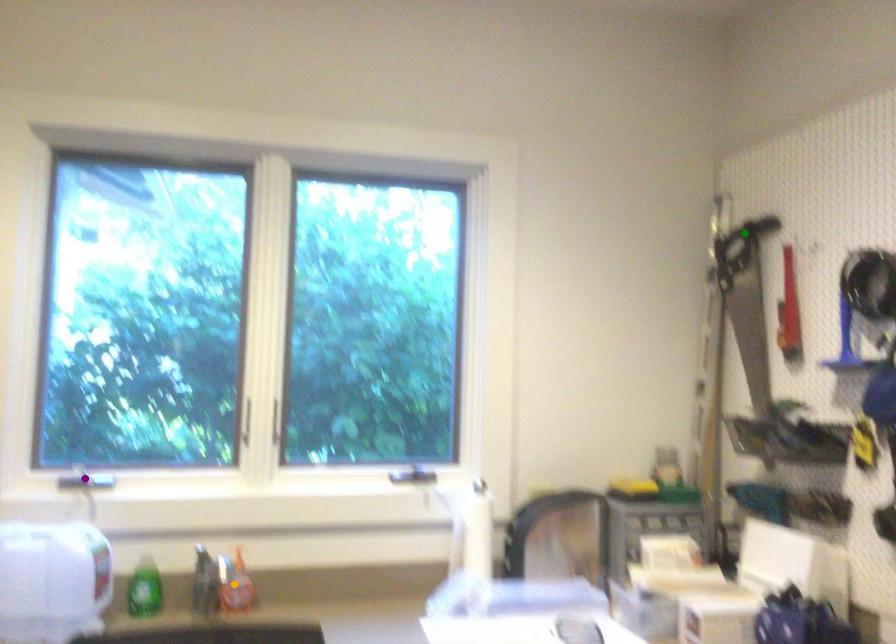
Order these from farthest to nearest:
orange point, green point, purple point

1. green point
2. purple point
3. orange point